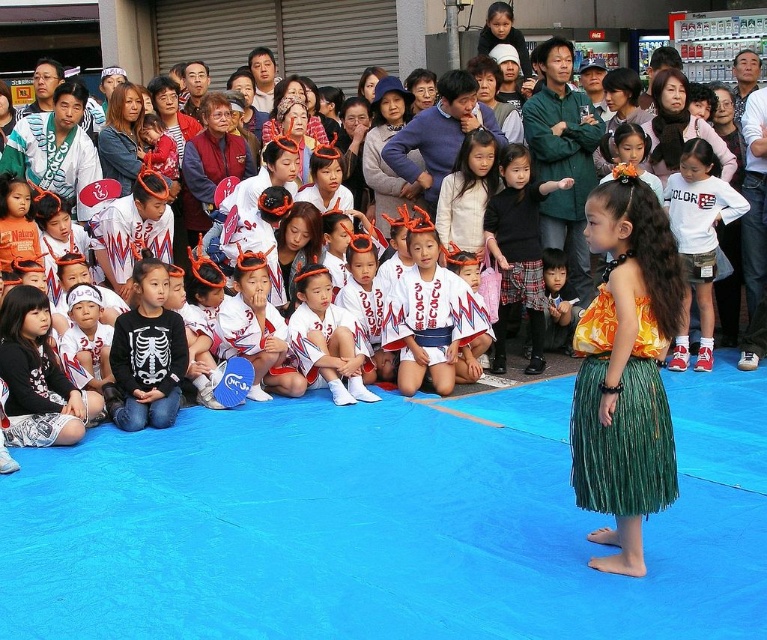
Question: Is green grass skirt at lower right in front of white cotton shirt at center?

Choices:
 (A) no
 (B) yes

Answer: (B)

Question: Observing the image, what is the correct spatial positioning of white cotton clothing at upper center in reference to white fabric uniform at center?

Choices:
 (A) right
 (B) left

Answer: (A)

Question: Is white cotton clothing at upper center smaller than black fabric skirt at center?

Choices:
 (A) no
 (B) yes

Answer: (A)

Question: Which object appears closest to the camera in this image?

Choices:
 (A) white cotton clothing at upper center
 (B) green grass skirt at lower right
 (C) white fabric uniform at center

Answer: (B)

Question: Which point appears farthest from the camera in this image?

Choices:
 (A) (644, 355)
 (B) (509, 220)
 (C) (334, 339)
 (D) (703, 365)

Answer: (B)

Question: Which point is farther from the camera taking this photo?

Choices:
 (A) (509, 209)
 (B) (334, 312)
 (C) (45, 262)
 (D) (695, 244)

Answer: (A)